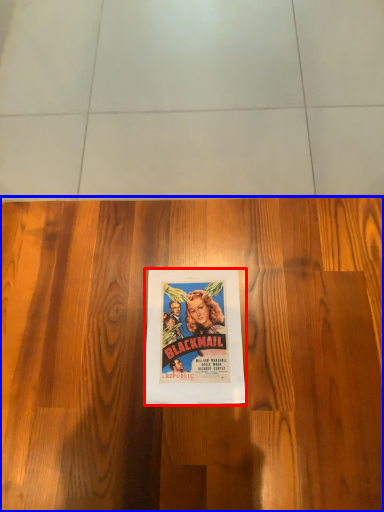
Question: Among these objects, which one is nearest to the camera, poster (highlighted by a red box) or hardwood (highlighted by a blue box)?

Choices:
 (A) poster
 (B) hardwood

Answer: (B)